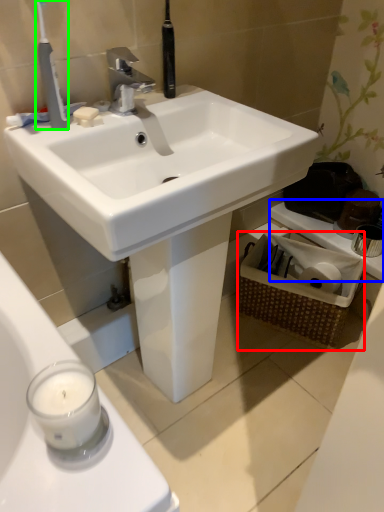
Question: Which object is the closest to the basket (highlighted by a red box)? Choose among these: counter top (highlighted by a blue box) or toothbrush (highlighted by a green box).

Choices:
 (A) counter top
 (B) toothbrush

Answer: (A)